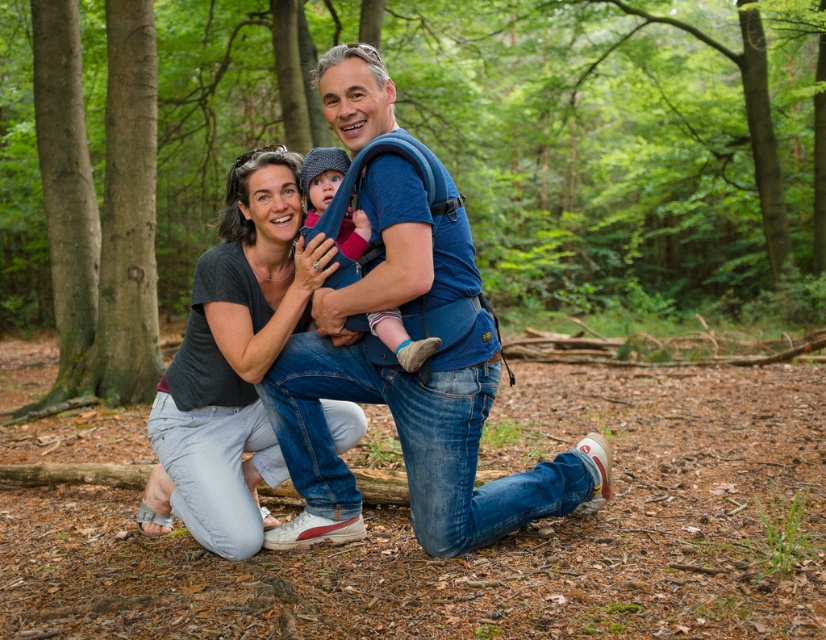
Is point (221, 58) farther from camera compared to point (609, 460)?

Yes, it is.

In the scene shown: Who is higher up, green leafy forest at center or blue fabric baby carrier at center?

green leafy forest at center is above.

Which is in front, point (169, 28) or point (355, 90)?

Positioned in front is point (355, 90).

Locate an element on the screen. This screenshot has width=826, height=640. green leafy forest at center is located at coordinates (622, 144).

Is blue fabric baby carrier at center thinner than matte gray shirt at center?

No, blue fabric baby carrier at center is not thinner than matte gray shirt at center.

Is point (387, 272) closer to camera compared to point (263, 330)?

Yes, point (387, 272) is in front of point (263, 330).

This screenshot has height=640, width=826. What are the coordinates of `blue fabric baby carrier at center` in the screenshot? It's located at (409, 392).

Does green leafy forest at center have a greater height compared to knitted wool hat at center?

Correct, green leafy forest at center is much taller as knitted wool hat at center.

Can you confirm if green leafy forest at center is positioned below knitted wool hat at center?

No, green leafy forest at center is not below knitted wool hat at center.

Find the location of a particular element. This screenshot has height=640, width=826. green leafy forest at center is located at coordinates (622, 144).